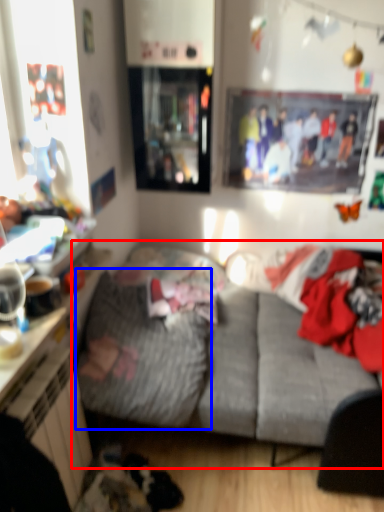
Question: Which point is further to the camera, studio couch (highlighted by a red box) or blanket (highlighted by a blue box)?

Choices:
 (A) studio couch
 (B) blanket

Answer: (B)